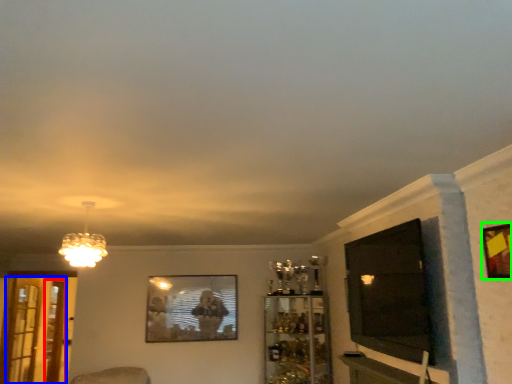
Question: Considering the real-world distances, which object is closest to screen door (highlighted by a red box)? screen door (highlighted by a blue box) or picture frame (highlighted by a green box).

Choices:
 (A) screen door
 (B) picture frame

Answer: (A)